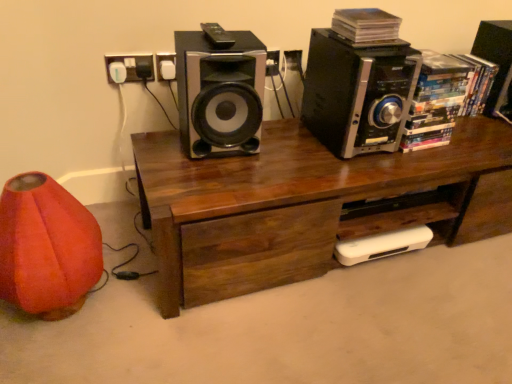
Question: Is orange fabric bean bag chair at lower left oriented towards white plastic socket at upper left?

Choices:
 (A) yes
 (B) no

Answer: (B)

Question: Would you say orange fabric bean bag chair at lower left is outside white plastic socket at upper left?

Choices:
 (A) no
 (B) yes

Answer: (B)

Question: From the image's perspective, does orange fabric bean bag chair at lower left appear higher than white plastic socket at upper left?

Choices:
 (A) no
 (B) yes

Answer: (A)

Question: Can you confirm if orange fabric bean bag chair at lower left is taller than white plastic socket at upper left?

Choices:
 (A) yes
 (B) no

Answer: (A)

Question: From the image's perspective, would you say orange fabric bean bag chair at lower left is shown under white plastic socket at upper left?

Choices:
 (A) yes
 (B) no

Answer: (A)

Question: Does orange fabric bean bag chair at lower left lie behind white plastic socket at upper left?

Choices:
 (A) yes
 (B) no

Answer: (B)

Question: Is black plastic speaker at upper right, which is the third speaker in left-to-right order, aimed at black metallic speaker at upper right, which is counted as the second speaker, starting from the left?

Choices:
 (A) yes
 (B) no

Answer: (B)

Question: Is black plastic speaker at upper right, the 1th speaker from the right, not inside black metallic speaker at upper right, acting as the 2th speaker starting from the right?

Choices:
 (A) yes
 (B) no

Answer: (A)

Question: Considering the relative sizes of black plastic speaker at upper right, which is the third speaker in left-to-right order, and black metallic speaker at upper right, acting as the 2th speaker starting from the right, in the image provided, is black plastic speaker at upper right, which is the third speaker in left-to-right order, shorter than black metallic speaker at upper right, acting as the 2th speaker starting from the right,?

Choices:
 (A) no
 (B) yes

Answer: (A)

Question: Considering the relative sizes of black plastic speaker at upper right, which is the third speaker in left-to-right order, and black metallic speaker at upper right, acting as the 2th speaker starting from the right, in the image provided, is black plastic speaker at upper right, which is the third speaker in left-to-right order, bigger than black metallic speaker at upper right, acting as the 2th speaker starting from the right,?

Choices:
 (A) no
 (B) yes

Answer: (A)

Question: Is black plastic speaker at upper right, which is the third speaker in left-to-right order, facing away from black metallic speaker at upper right, which is counted as the second speaker, starting from the left?

Choices:
 (A) no
 (B) yes

Answer: (A)

Question: Is black plastic speaker at upper right, the 1th speaker from the right, thinner than black metallic speaker at upper right, acting as the 2th speaker starting from the right?

Choices:
 (A) yes
 (B) no

Answer: (A)

Question: Is black metallic speaker at upper right, which is counted as the second speaker, starting from the left, outside metallic silver speaker at center, which is counted as the 1th speaker, starting from the left?

Choices:
 (A) yes
 (B) no

Answer: (A)